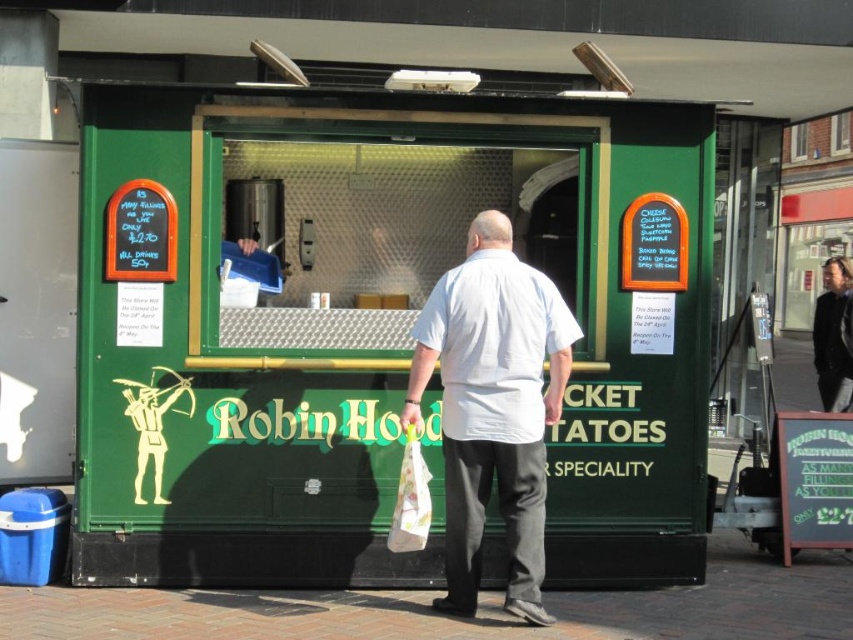
Question: Considering the real-world distances, which object is closest to the white cotton shirt at center?

Choices:
 (A) green matte food truck at center
 (B) black leather jacket at upper right
 (C) white fabric bag at lower center

Answer: (C)

Question: Is black leather jacket at upper right wider than white fabric bag at lower center?

Choices:
 (A) yes
 (B) no

Answer: (A)

Question: Does black leather jacket at upper right appear over white fabric bag at lower center?

Choices:
 (A) no
 (B) yes

Answer: (B)

Question: Which point is farther from the camera taking this photo?

Choices:
 (A) (838, 317)
 (B) (376, 428)
 (C) (518, 612)
 (D) (418, 481)

Answer: (A)

Question: Which object appears closest to the camera in this image?

Choices:
 (A) white fabric bag at lower center
 (B) black leather jacket at upper right
 (C) green matte food truck at center
 (D) white cotton shirt at center

Answer: (A)

Question: Can you confirm if green matte food truck at center is positioned to the left of white fabric bag at lower center?

Choices:
 (A) no
 (B) yes

Answer: (B)